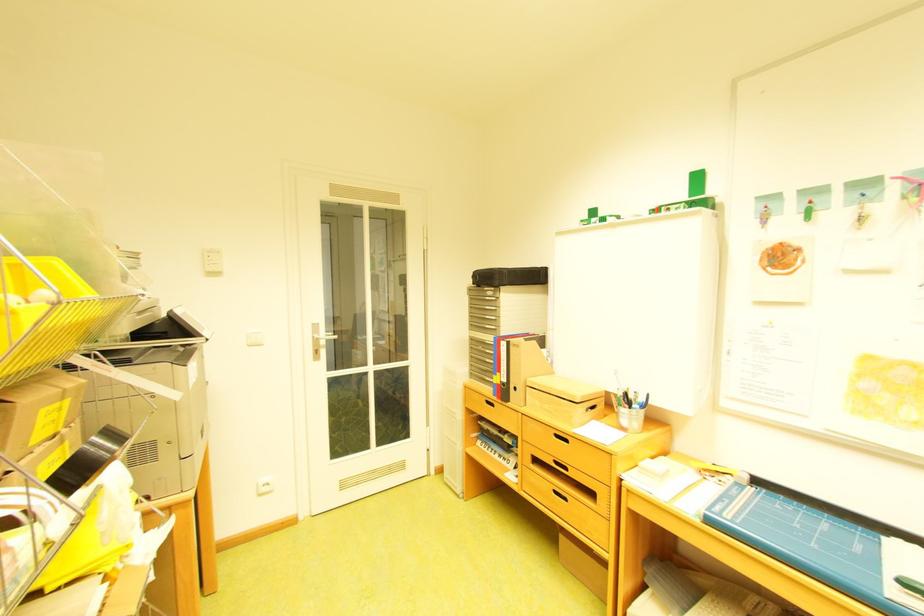
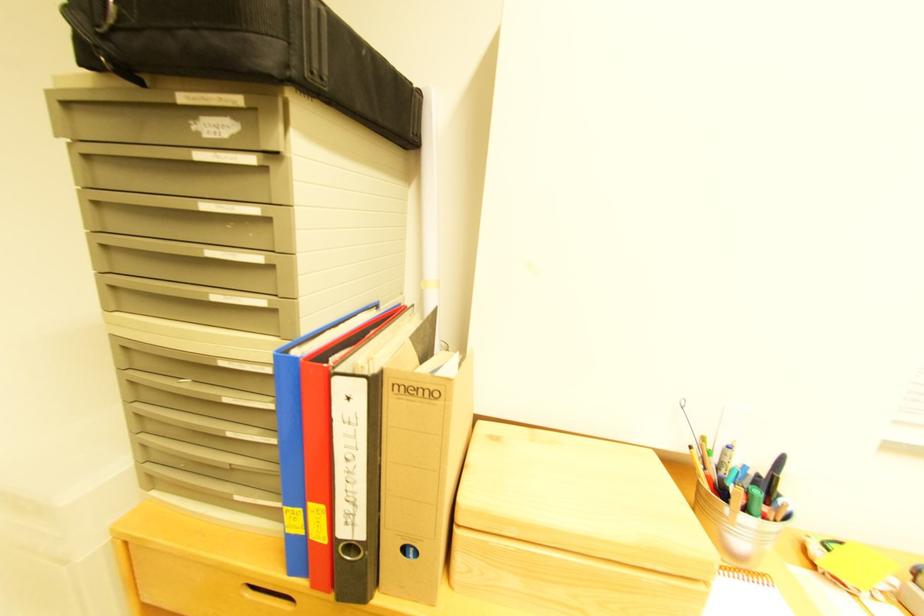
The point at [497,342] is marked in the first image. Where is the corresponding point in the second image?

(235, 363)